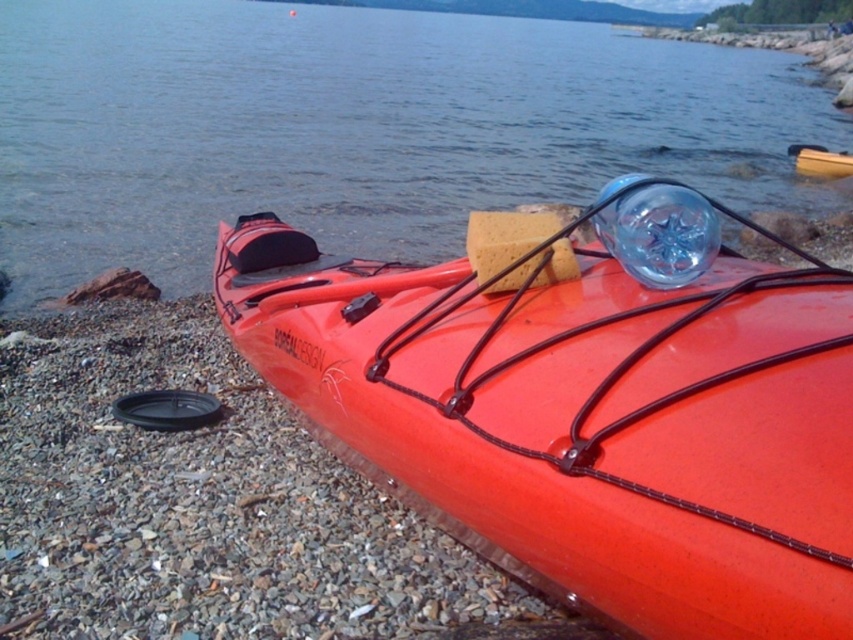
You are a hiker who just arrived at the lakeside. You see the orange matte kayak at center and the transparent plastic water at upper center. Which object is shorter in height?

The orange matte kayak at center has a lesser height compared to transparent plastic water at upper center, so the orange matte kayak at center is shorter in height.

In the scene shown: You are standing on the shoreline looking at the orange kayak at center. What object is located exactly at the point with coordinates (585,403)?

The orange matte kayak at center is located exactly at the point with coordinates (585,403).

From the picture: You are standing on the shoreline and see the transparent plastic water at upper center and the orange plastic canoe at center. Which object is higher in the image?

The transparent plastic water at upper center is above the orange plastic canoe at center in the image.